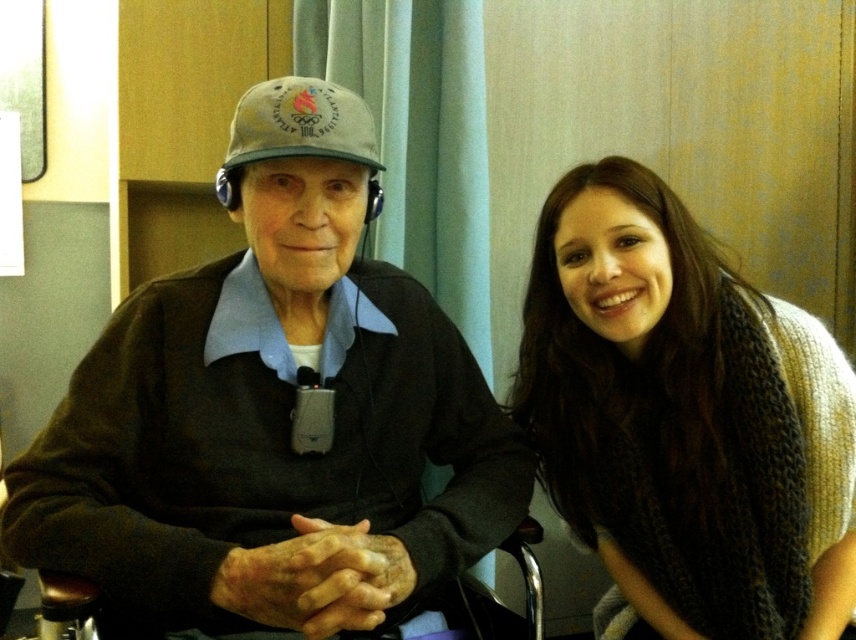
Question: Is knitted scarf at right to the left of khaki fabric baseball cap at upper center from the viewer's perspective?

Choices:
 (A) yes
 (B) no

Answer: (B)

Question: Is matte gray cap at center above khaki fabric baseball cap at upper center?

Choices:
 (A) yes
 (B) no

Answer: (B)

Question: Estimate the real-world distances between objects in this image. Which object is farther from the khaki fabric baseball cap at upper center?

Choices:
 (A) matte gray cap at center
 (B) knitted scarf at right

Answer: (B)

Question: Which point is farther to the camera?

Choices:
 (A) (336, 106)
 (B) (372, 157)
 (C) (770, 381)

Answer: (C)

Question: Among these objects, which one is farthest from the camera?

Choices:
 (A) knitted scarf at right
 (B) matte gray cap at center
 (C) khaki fabric baseball cap at upper center

Answer: (A)

Question: Is knitted scarf at right smaller than khaki fabric baseball cap at upper center?

Choices:
 (A) yes
 (B) no

Answer: (B)